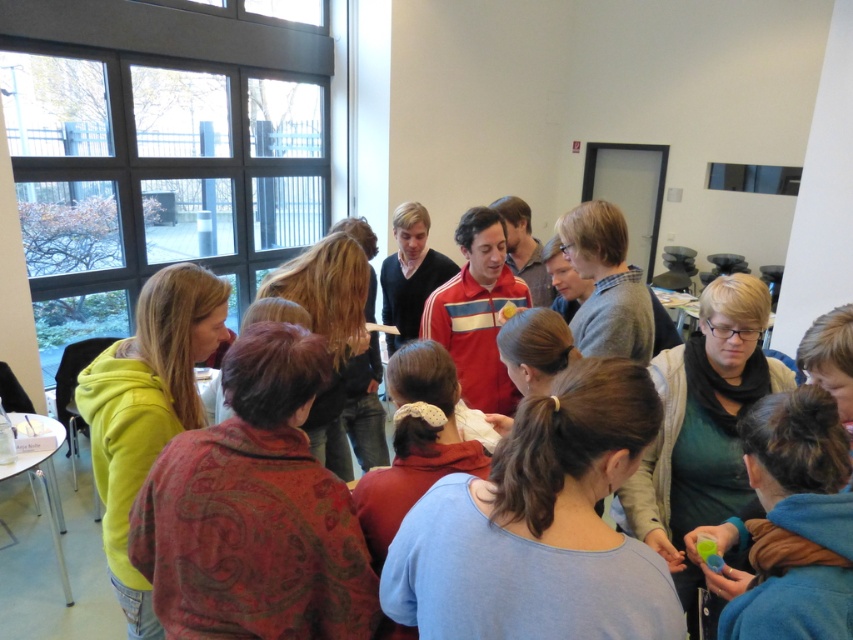
Does light blue fabric shirt at center appear over matte yellow hoodie at left?

Correct, light blue fabric shirt at center is located above matte yellow hoodie at left.

Is point (527, 445) closer to viewer compared to point (151, 388)?

Yes.

Where is `light blue fabric shirt at center`? light blue fabric shirt at center is located at coordinates (540, 525).